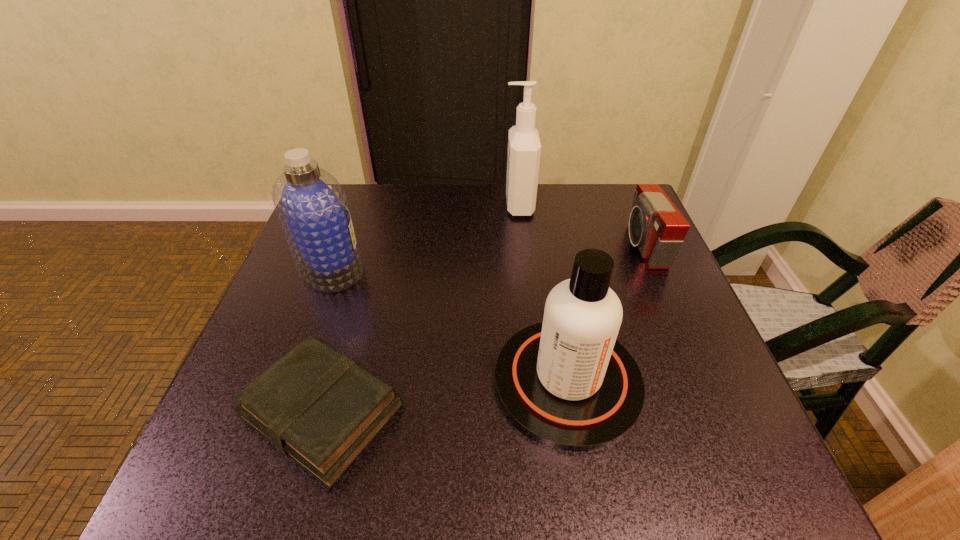
Identify the location of book at the left edge. This screenshot has height=540, width=960. (318, 407).

Locate an element on the screen. The width and height of the screenshot is (960, 540). cleansing agent that is positioned at the right edge is located at coordinates (566, 382).

Image resolution: width=960 pixels, height=540 pixels. Find the location of `camera that is at the right edge`. camera that is at the right edge is located at coordinates (656, 226).

Locate an element on the screen. The image size is (960, 540). object present at the near left corner is located at coordinates (318, 407).

You are a GUI agent. You are given a task and a screenshot of the screen. Output one action in this format:
    pyautogui.click(x=<x>, y=<y>)
    Task: Click on the object present at the far right corner
    Image resolution: width=960 pixels, height=540 pixels.
    Given the screenshot: What is the action you would take?
    pyautogui.click(x=656, y=226)

What are the coordinates of `object located in the near right corner section of the desktop` in the screenshot? It's located at (566, 382).

In the image, there is a desktop. Where is `blank space at the far edge`? blank space at the far edge is located at coordinates (396, 202).

Find the location of `vacant region at the left edge of the desktop`. vacant region at the left edge of the desktop is located at coordinates (328, 321).

Locate an element on the screen. vacant space at the far left corner of the desktop is located at coordinates (359, 197).

Locate an element on the screen. vacant space at the far right corner is located at coordinates (625, 207).